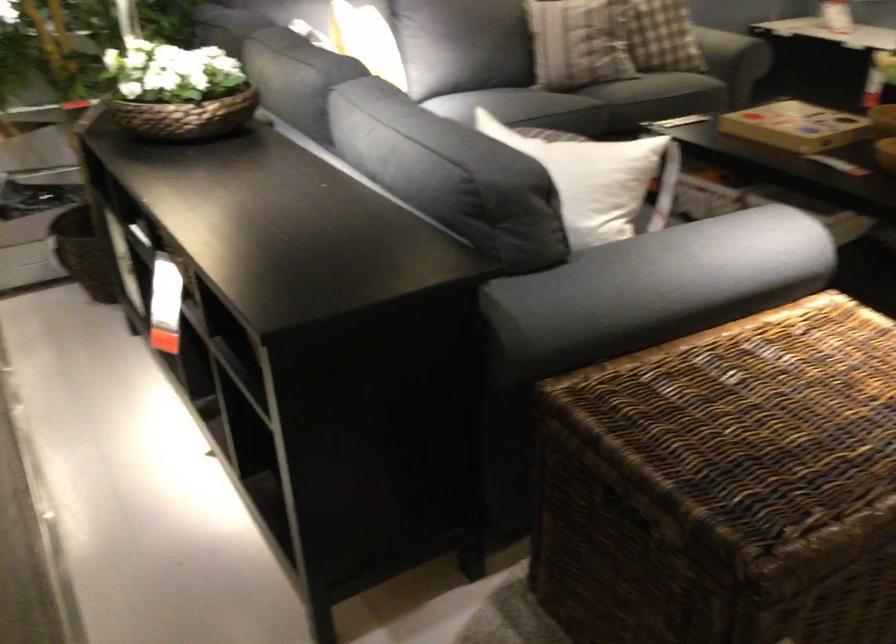
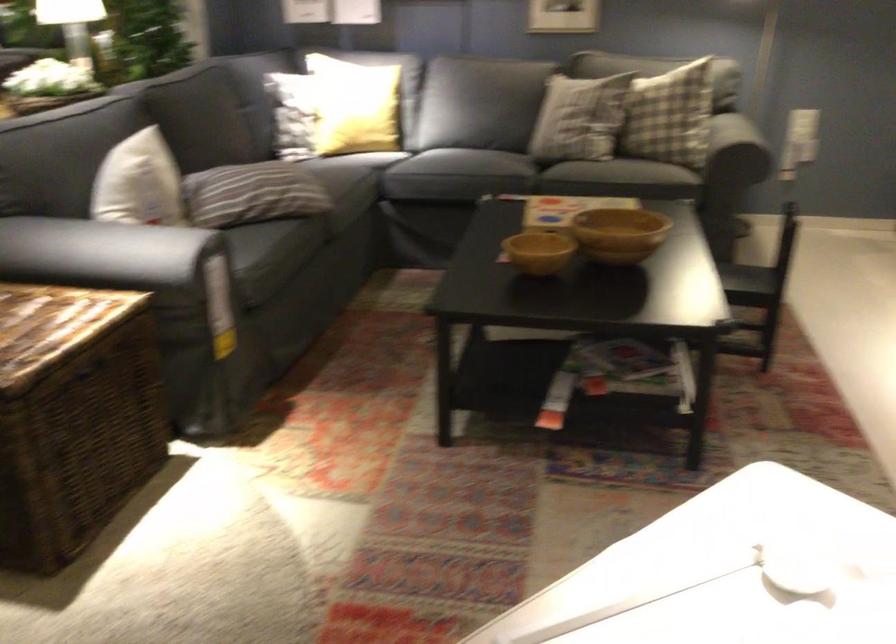
The point at (782, 330) is marked in the first image. Where is the corresponding point in the second image?

(55, 317)